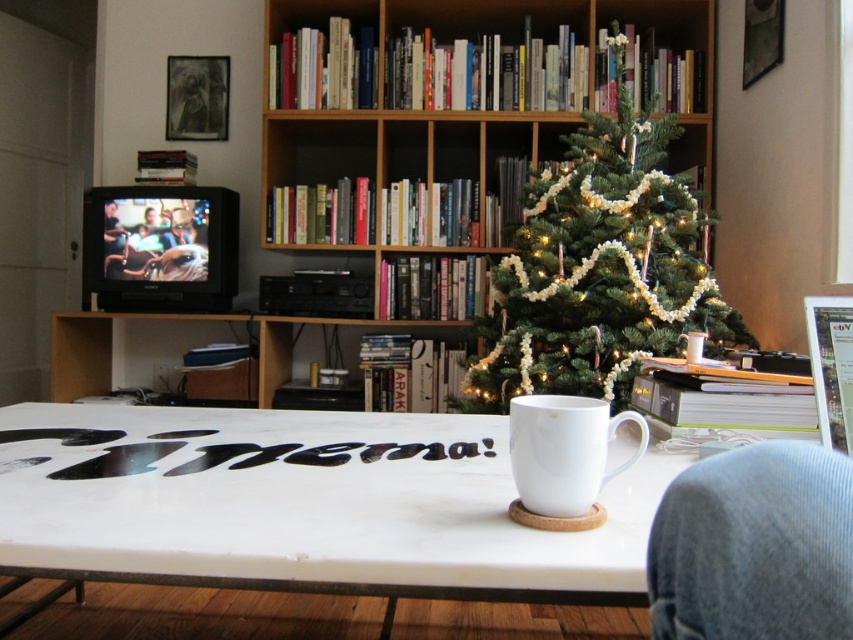
Based on the photo, does white glossy table at center have a smaller size compared to green textured christmas tree at center?

Indeed, white glossy table at center has a smaller size compared to green textured christmas tree at center.

Does point (206, 424) lie in front of point (498, 406)?

That is True.

Where is `white glossy table at center`? white glossy table at center is located at coordinates point(302,504).

At what (x,y) coordinates should I click in order to perform the action: click on white glossy table at center. Please return your answer as a coordinate pair (x, y). Image resolution: width=853 pixels, height=640 pixels. Looking at the image, I should click on (302, 504).

Can you confirm if white glossy table at center is wider than white ceramic mug at center?

Correct, the width of white glossy table at center exceeds that of white ceramic mug at center.

Can you confirm if white glossy table at center is positioned above white ceramic mug at center?

Actually, white glossy table at center is below white ceramic mug at center.

Is point (80, 406) positioned before point (570, 445)?

No, it is behind (570, 445).

The height and width of the screenshot is (640, 853). I want to click on white glossy table at center, so click(x=302, y=504).

Is green textured christmas tree at center shorter than white ceramic mug at center?

In fact, green textured christmas tree at center may be taller than white ceramic mug at center.

Is green textured christmas tree at center smaller than white ceramic mug at center?

No.

Identify the location of green textured christmas tree at center. (601, 268).

You are a GUI agent. You are given a task and a screenshot of the screen. Output one action in this format:
    pyautogui.click(x=<x>, y=<y>)
    Task: Click on the green textured christmas tree at center
    Image resolution: width=853 pixels, height=640 pixels.
    Given the screenshot: What is the action you would take?
    pyautogui.click(x=601, y=268)